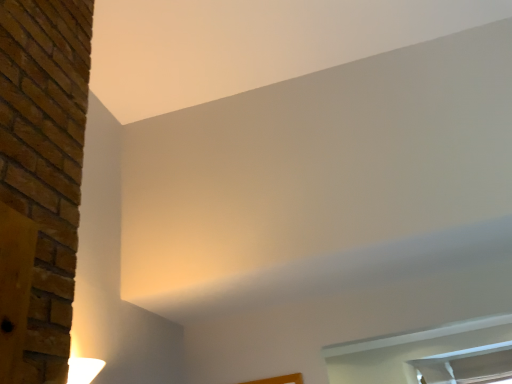
Question: Would you say clear glass window at lower right, acting as the second window starting from the bottom, is to the left or to the right of clear glass window at lower right, marked as the first window in a bottom-to-top arrangement, in the picture?

Choices:
 (A) right
 (B) left

Answer: (B)

Question: From their relative heights in the image, would you say clear glass window at lower right, which appears as the 1th window when viewed from the top, is taller or shorter than clear glass window at lower right, the 2th window from the top?

Choices:
 (A) short
 (B) tall

Answer: (A)

Question: Is clear glass window at lower right, acting as the second window starting from the bottom, spatially inside clear glass window at lower right, the 2th window from the top, or outside of it?

Choices:
 (A) inside
 (B) outside

Answer: (B)

Question: From a real-world perspective, is clear glass window at lower right, marked as the first window in a bottom-to-top arrangement, above or below clear glass window at lower right, which appears as the 1th window when viewed from the top?

Choices:
 (A) below
 (B) above

Answer: (A)

Question: Does point (480, 365) appear closer or farther from the camera than point (480, 365)?

Choices:
 (A) closer
 (B) farther

Answer: (B)

Question: In the image, is clear glass window at lower right, marked as the first window in a bottom-to-top arrangement, on the left side or the right side of clear glass window at lower right, acting as the second window starting from the bottom?

Choices:
 (A) left
 (B) right

Answer: (B)

Question: Is clear glass window at lower right, the 2th window from the top, taller or shorter than clear glass window at lower right, which appears as the 1th window when viewed from the top?

Choices:
 (A) tall
 (B) short

Answer: (A)